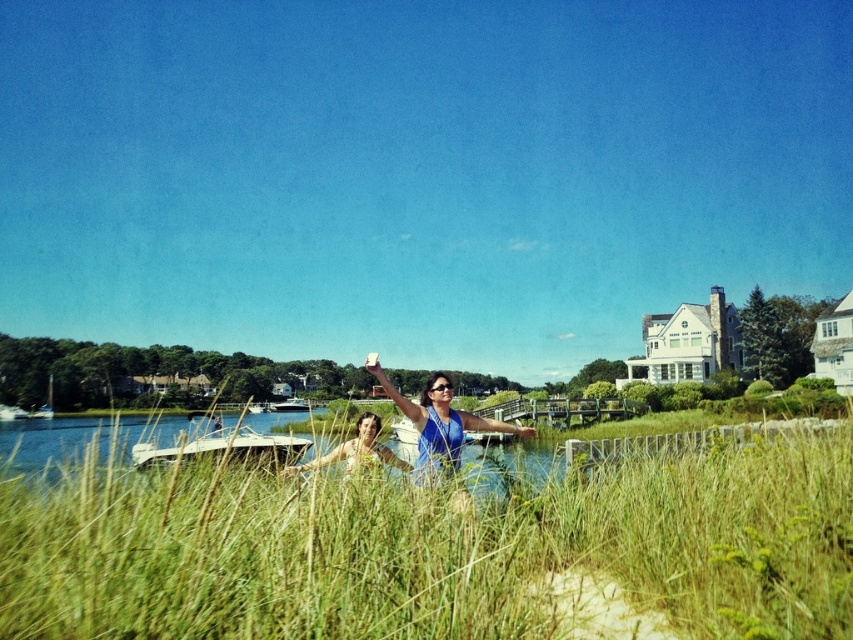
You are a photographer trying to capture a clear shot of the wooden pier in the lake. You notice two points marked in the scene. Which point, point (x=357, y=451) or point (x=306, y=408), is closer to your camera lens?

Point (x=357, y=451) is closer to the camera than point (x=306, y=408), so you should focus on that point for a clearer shot.